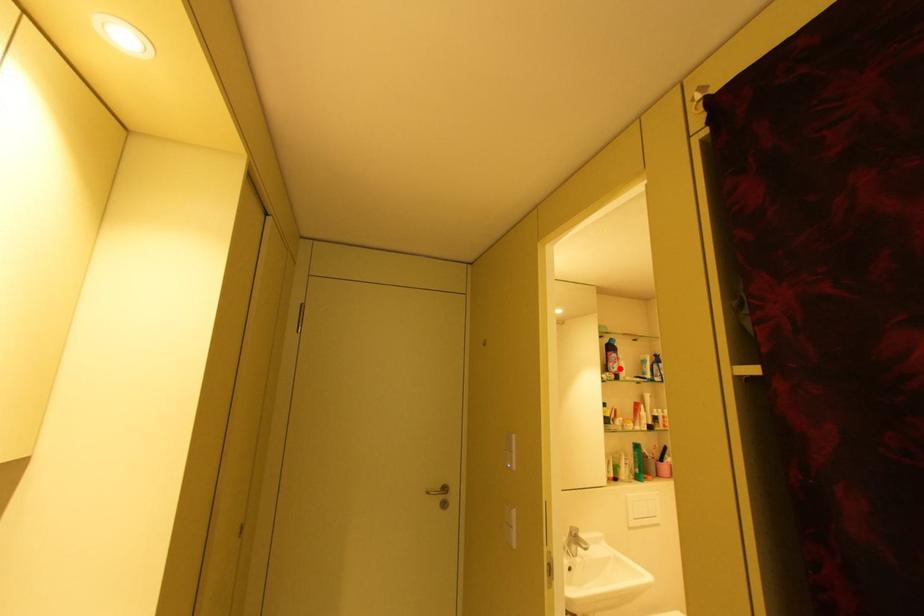
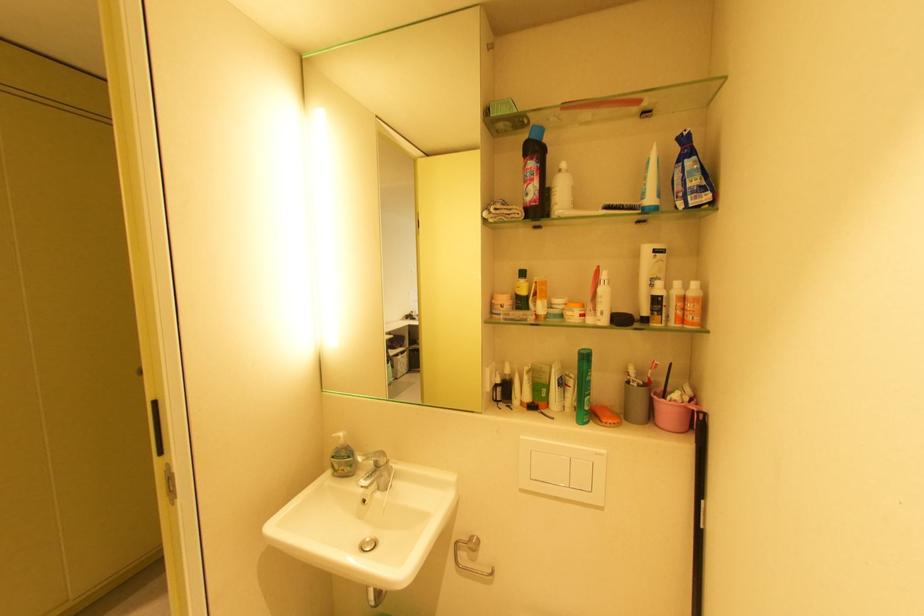
In the second image, find the point that corresponds to the highlighted location in the first image.

(533, 196)